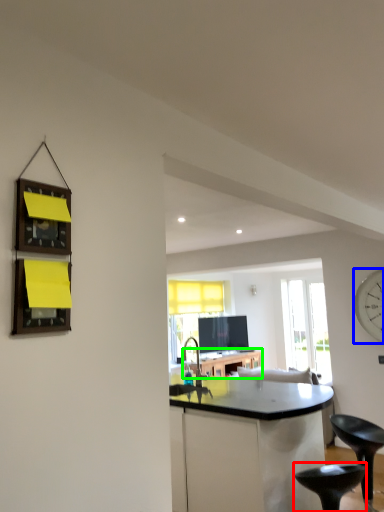
Question: Which is nearer to the stool (highlighted by a red box)? clock (highlighted by a blue box) or table (highlighted by a green box).

Choices:
 (A) clock
 (B) table

Answer: (A)